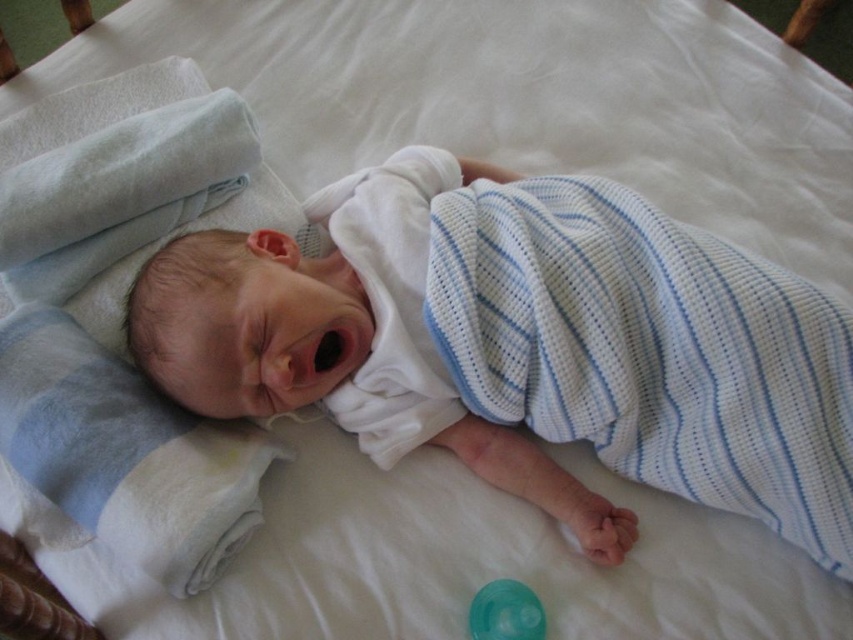
How much distance is there between blue striped swaddle at upper left and transparent plastic pacifier at center?

A distance of 22.16 inches exists between blue striped swaddle at upper left and transparent plastic pacifier at center.

Does blue striped swaddle at upper left have a greater width compared to transparent plastic pacifier at center?

Correct, the width of blue striped swaddle at upper left exceeds that of transparent plastic pacifier at center.

Is point (50, 198) farther from viewer compared to point (469, 618)?

Yes, it is.

Where is `blue striped swaddle at upper left`? This screenshot has height=640, width=853. blue striped swaddle at upper left is located at coordinates (120, 312).